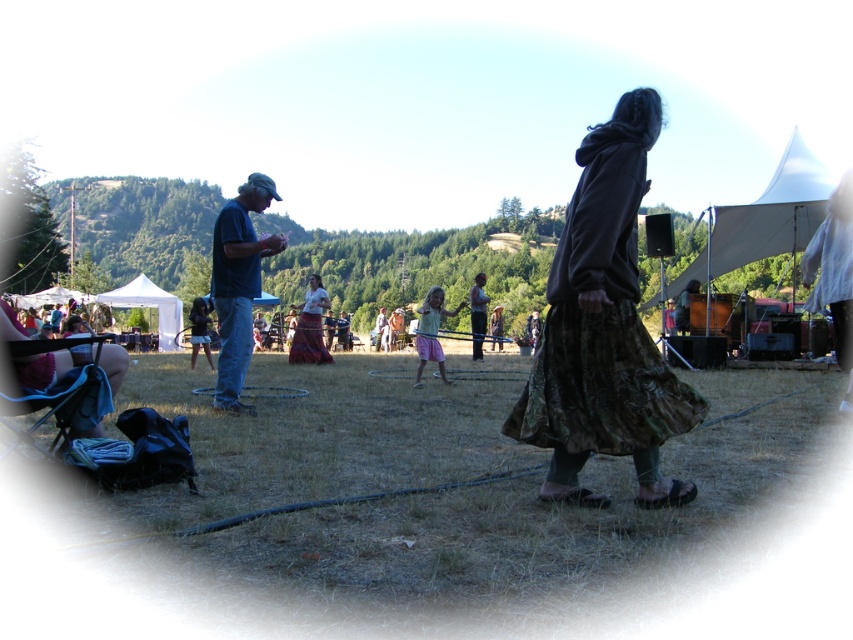
You are a photographer trying to capture the scene. You want to focus on the pink fabric dress at center and the dark brown textured coat at right. Which object should you adjust your camera to focus on first if you want to ensure both are in sharp focus?

The dark brown textured coat at right is closer to the viewer than the pink fabric dress at center. To ensure both are in sharp focus, you should focus on the pink fabric dress at center first, as it is farther away, allowing the depth of field to cover the closer object.